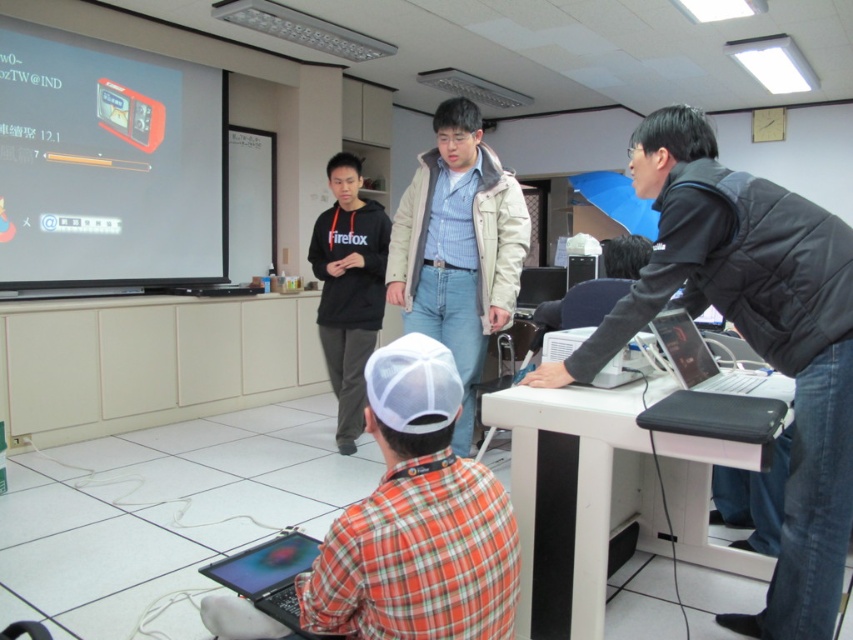
You are standing in the classroom and need to locate the matte black projector screen at upper left. Based on the coordinates provided, where should you look relative to your current position?

The matte black projector screen at upper left is located at coordinates point (107,164), which means it is positioned to the upper left of your current view in the classroom.